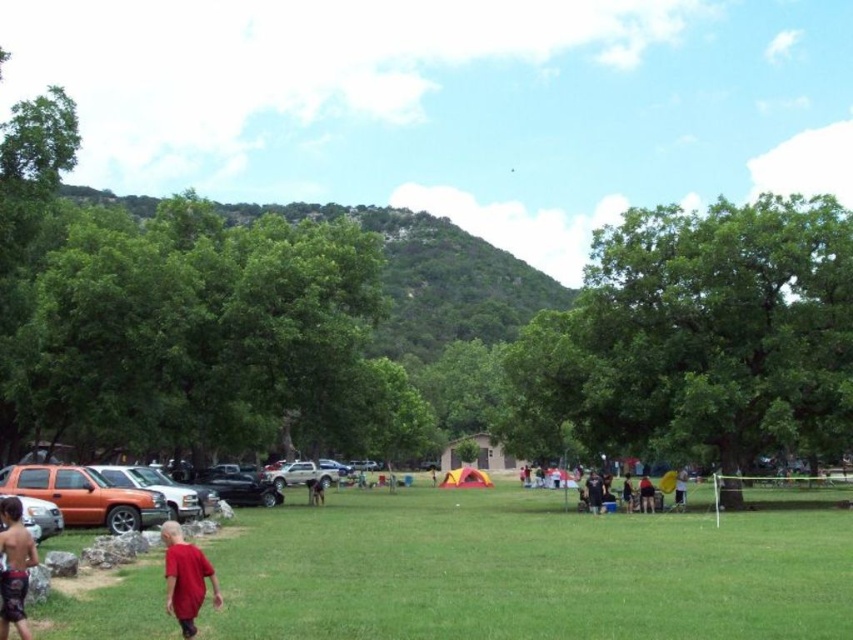
Between green grassy field at center and shiny orange shorts at lower left, which one is positioned lower?

Positioned lower is green grassy field at center.

Is green grassy field at center wider than shiny orange shorts at lower left?

Correct, the width of green grassy field at center exceeds that of shiny orange shorts at lower left.

Between point (349, 620) and point (3, 506), which one is positioned in front?

Point (3, 506) is more forward.

Locate an element on the screen. green grassy field at center is located at coordinates [x=527, y=570].

Is orange matte suv at lower left bigger than matte red shirt at lower left?

Yes.

Based on the photo, between orange matte suv at lower left and matte red shirt at lower left, which one appears on the left side from the viewer's perspective?

Positioned to the left is orange matte suv at lower left.

I want to click on orange matte suv at lower left, so click(85, 497).

Does orange matte suv at lower left come behind shiny orange shorts at lower left?

Yes, orange matte suv at lower left is further from the viewer.

Can you confirm if orange matte suv at lower left is positioned above shiny orange shorts at lower left?

No, orange matte suv at lower left is not above shiny orange shorts at lower left.

What do you see at coordinates (85, 497) in the screenshot?
I see `orange matte suv at lower left` at bounding box center [85, 497].

At what (x,y) coordinates should I click in order to perform the action: click on orange matte suv at lower left. Please return your answer as a coordinate pair (x, y). Looking at the image, I should click on (85, 497).